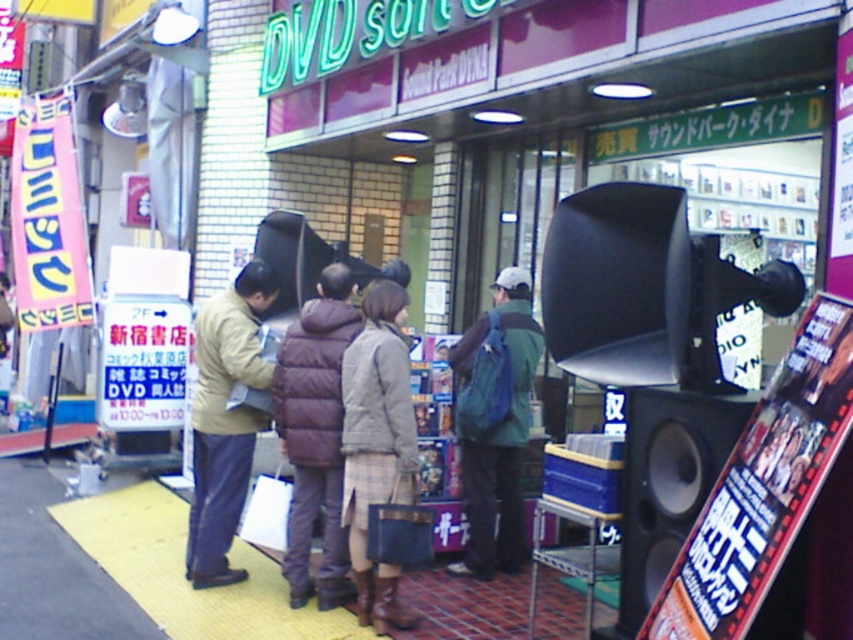
Can you confirm if black matte speaker at right is thinner than green fabric backpack at center?

Yes, black matte speaker at right is thinner than green fabric backpack at center.

Is black matte speaker at right further to camera compared to green fabric backpack at center?

No, it is not.

Is point (700, 456) positioned in front of point (509, 404)?

That is True.

The height and width of the screenshot is (640, 853). I want to click on black matte speaker at right, so click(666, 483).

Based on the photo, is black matte speaker at right to the right of light brown leather jacket at center from the viewer's perspective?

Indeed, black matte speaker at right is positioned on the right side of light brown leather jacket at center.

Find the location of a particular element. black matte speaker at right is located at coordinates (666, 483).

Who is more distant from viewer, (647, 515) or (236, 276)?

Point (236, 276)

I want to click on black matte speaker at right, so click(666, 483).

Does dark brown puffy coat at center have a lesser height compared to light brown fabric coat at center?

In fact, dark brown puffy coat at center may be taller than light brown fabric coat at center.

Is dark brown puffy coat at center wider than light brown fabric coat at center?

Correct, the width of dark brown puffy coat at center exceeds that of light brown fabric coat at center.

Identify the location of dark brown puffy coat at center. pos(315,435).